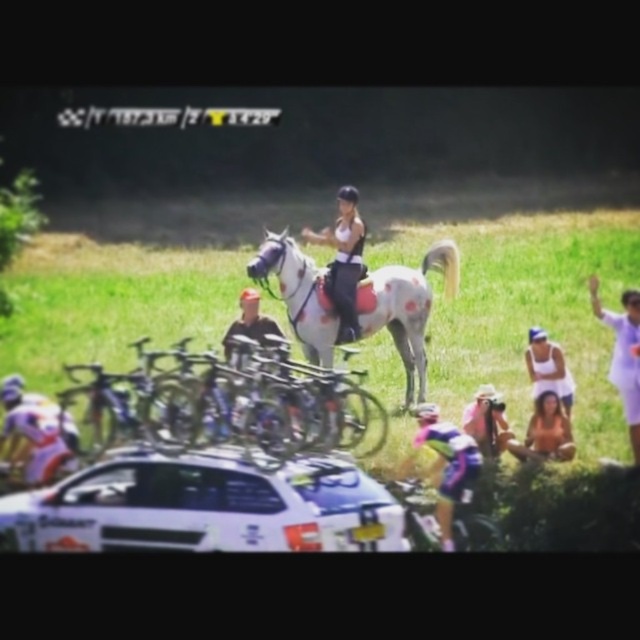
Can you confirm if pink fabric cyclist at lower center is smaller than brown textured fabric at lower right?

Incorrect, pink fabric cyclist at lower center is not smaller in size than brown textured fabric at lower right.

At what (x,y) coordinates should I click in order to perform the action: click on pink fabric cyclist at lower center. Please return your answer as a coordinate pair (x, y). Looking at the image, I should click on (445, 465).

Identify the location of pink fabric cyclist at lower center. (445, 465).

Between point (314, 296) and point (468, 460), which one is positioned behind?

The point (314, 296) is more distant.

Can you confirm if white speckled horse at center is positioned below pink fabric cyclist at lower center?

No.

Image resolution: width=640 pixels, height=640 pixels. I want to click on white speckled horse at center, so click(x=406, y=308).

Locate an element on the screen. The image size is (640, 640). white speckled horse at center is located at coordinates (406, 308).

Who is taller, silver metallic bicycle at center or white speckled horse at center?

white speckled horse at center is taller.

Is point (67, 472) positioned behind point (392, 298)?

That is False.

Does point (284, 456) come farther from viewer compared to point (307, 337)?

No, it is in front of (307, 337).

I want to click on silver metallic bicycle at center, so click(x=220, y=404).